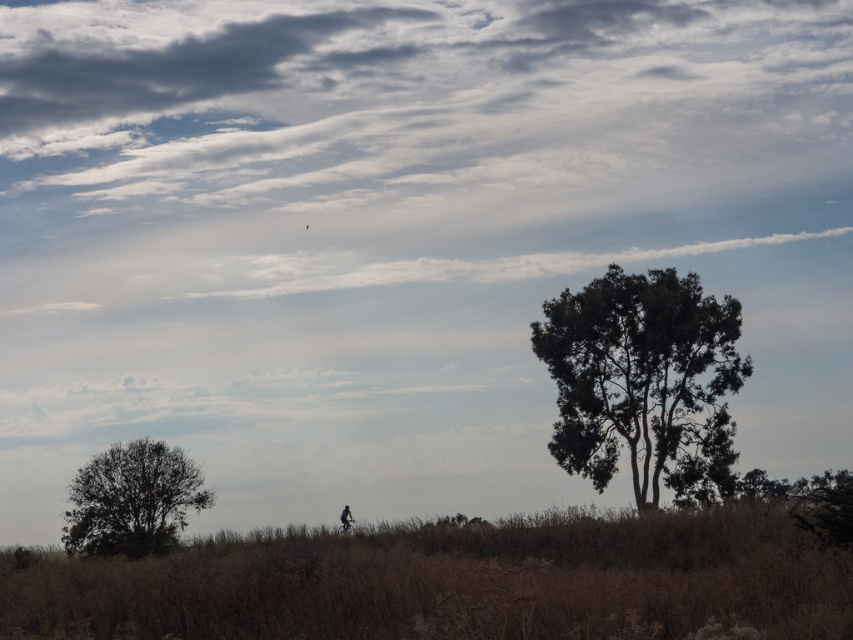
You are a hiker standing in the field of dry, golden brown grasses. You see the dark green leafy tree at lower left and the dark silhouette figure at lower center. Which object is closer to the left edge of the image?

The dark green leafy tree at lower left is positioned on the left side of the dark silhouette figure at lower center, so it is closer to the left edge of the image.

You are standing in the rural landscape and want to walk from the point at coordinates (96,480) to the point at (340,513). Which direction should you face to walk directly towards your destination?

You should face towards the upper right direction to walk from point (96,480) to point (340,513) since it is located above and to the right of the starting point.

Looking at the rural landscape, you notice a green leafy tree at right and a dark green leafy tree at lower left. Which tree has a wider spread of branches?

The green leafy tree at right has a wider spread of branches than the dark green leafy tree at lower left.